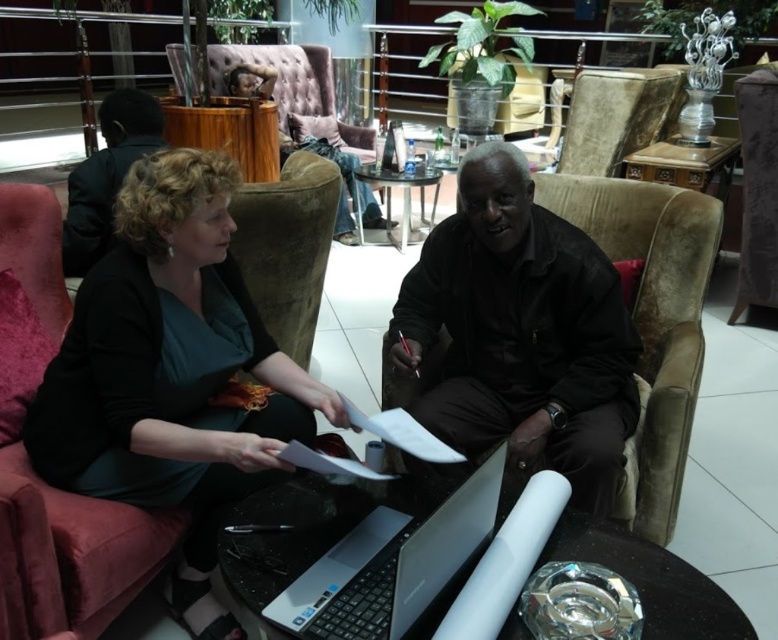
In the scene shown: Who is shorter, matte black jacket at center or silver metallic laptop at center?

With less height is silver metallic laptop at center.

Between point (272, 458) and point (414, 536), which one is positioned in front?

Positioned in front is point (414, 536).

Who is more distant from viewer, (x=247, y=317) or (x=433, y=552)?

The point (x=247, y=317) is more distant.

What are the coordinates of `matte black jacket at center` in the screenshot? It's located at (172, 372).

Does silver metallic laptop at center have a lesser height compared to dark brown leather jacket at upper left?

Correct, silver metallic laptop at center is not as tall as dark brown leather jacket at upper left.

In the scene shown: Does silver metallic laptop at center have a greater width compared to dark brown leather jacket at upper left?

Yes, silver metallic laptop at center is wider than dark brown leather jacket at upper left.

Is point (409, 531) closer to viewer compared to point (68, 266)?

That is True.

This screenshot has width=778, height=640. I want to click on silver metallic laptop at center, so click(x=391, y=564).

Can you confirm if black leather jacket at center is bigger than dark brown leather jacket at upper left?

Correct, black leather jacket at center is larger in size than dark brown leather jacket at upper left.

Locate an element on the screen. black leather jacket at center is located at coordinates (521, 332).

This screenshot has height=640, width=778. I want to click on black leather jacket at center, so click(521, 332).